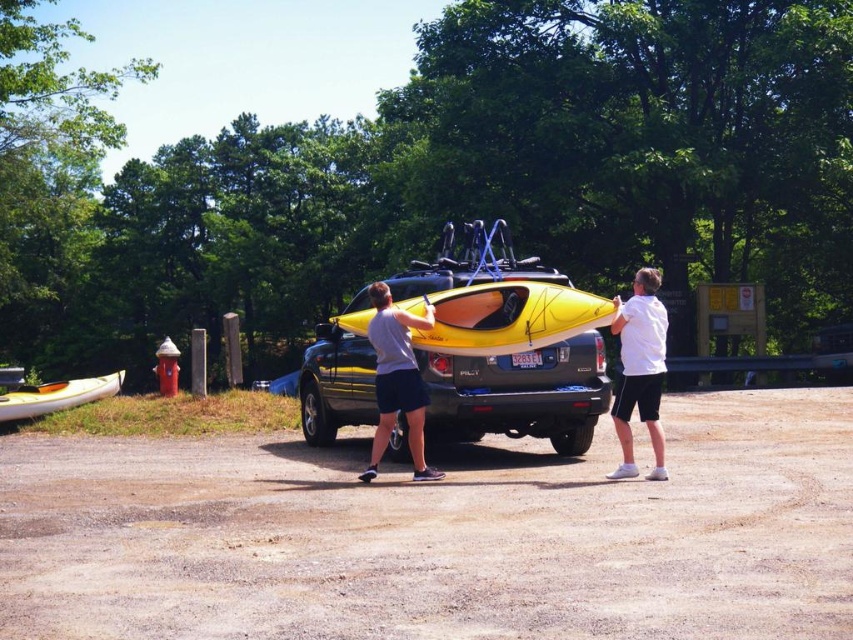
Is white matte shirt at right thinner than matte gray shorts at center?

Correct, white matte shirt at right's width is less than matte gray shorts at center's.

Can you confirm if white matte shirt at right is shorter than matte gray shorts at center?

In fact, white matte shirt at right may be taller than matte gray shorts at center.

Where is `white matte shirt at right`? white matte shirt at right is located at coordinates (640, 369).

Who is shorter, yellow matte kayak at center or white matte shirt at right?

Standing shorter between the two is yellow matte kayak at center.

Is point (474, 284) positioned behind point (654, 332)?

Yes, point (474, 284) is behind point (654, 332).

Who is more forward, (529,284) or (637,316)?

Point (637,316) is more forward.

Locate an element on the screen. This screenshot has height=640, width=853. yellow matte kayak at center is located at coordinates (505, 316).

Where is `yellow matte kayak at center`? This screenshot has height=640, width=853. yellow matte kayak at center is located at coordinates (505, 316).

Is point (550, 284) positioned behind point (403, 317)?

Yes, point (550, 284) is farther from viewer.

Between point (519, 342) and point (380, 332), which one is positioned in front?

Point (380, 332) is more forward.

Where is `yellow matte kayak at center`? yellow matte kayak at center is located at coordinates (505, 316).